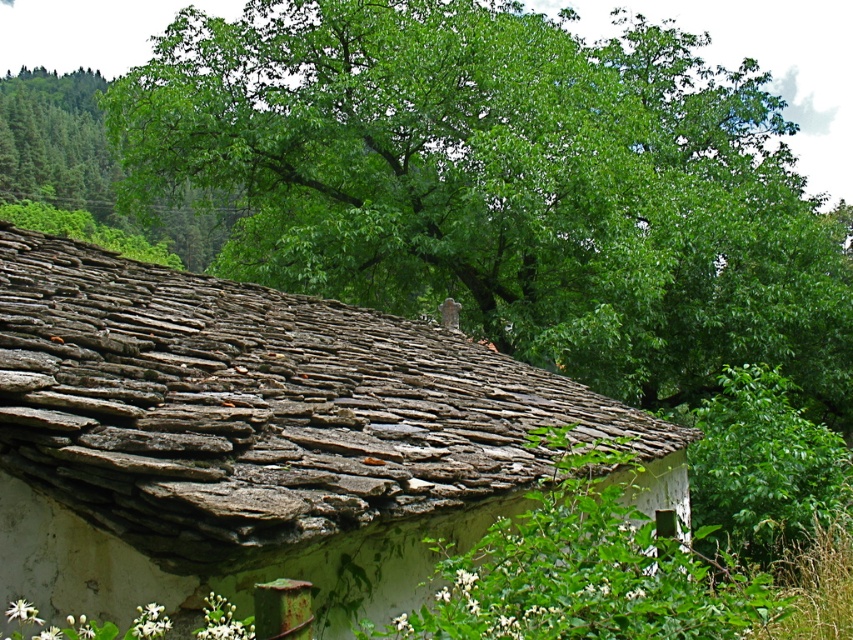
You are standing at point (x=505, y=186) in the image. What do you see directly in front of you?

You see a green leafy tree at upper center directly in front of you at point (x=505, y=186).